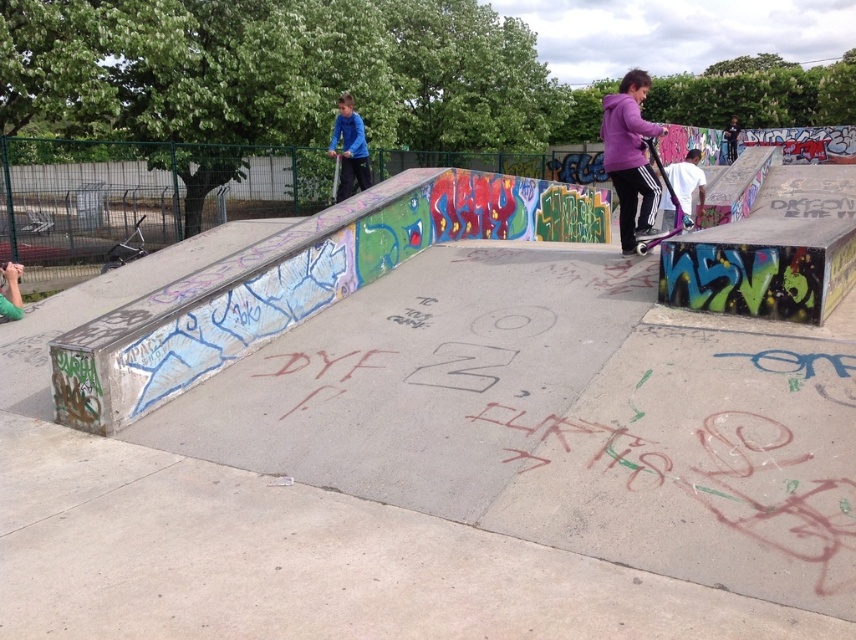
Measure the distance between metallic blue skateboard at center and camera.

metallic blue skateboard at center is 32.65 feet away from camera.

Looking at this image, is metallic blue skateboard at center smaller than metallic purple skateboard at center?

Yes, metallic blue skateboard at center is smaller than metallic purple skateboard at center.

Between point (664, 236) and point (331, 186), which one is positioned in front?

Point (664, 236)

Find the location of a particular element. This screenshot has width=856, height=640. metallic blue skateboard at center is located at coordinates (663, 236).

How far apart are metallic purple scooter at center-right and metallic purple skateboard at center?

metallic purple scooter at center-right is 6.38 meters away from metallic purple skateboard at center.

The width and height of the screenshot is (856, 640). What are the coordinates of `metallic purple scooter at center-right` in the screenshot? It's located at (667, 182).

Does point (681, 218) come closer to viewer compared to point (336, 193)?

That is True.

The image size is (856, 640). I want to click on metallic purple scooter at center-right, so click(667, 182).

Is point (663, 172) farther from viewer compared to point (676, 228)?

That is False.

Between metallic purple scooter at center-right and metallic blue skateboard at center, which one is positioned higher?

metallic purple scooter at center-right is higher up.

Is point (657, 161) farther from viewer compared to point (645, 241)?

Yes, it is behind point (645, 241).

Find the location of a particular element. The image size is (856, 640). metallic purple scooter at center-right is located at coordinates (667, 182).